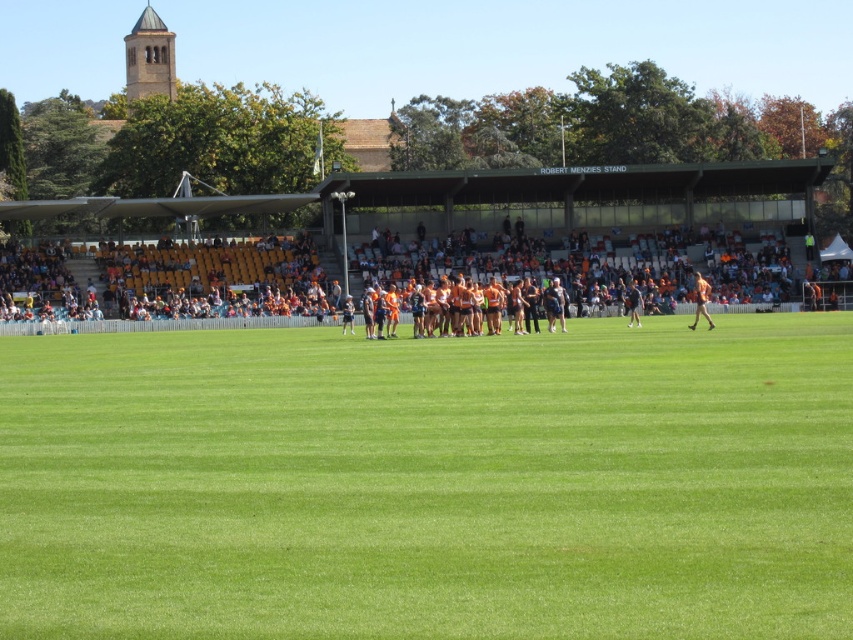
Looking at this image, can you confirm if orange jersey at center is positioned below orange uniformed person at center?

Actually, orange jersey at center is above orange uniformed person at center.

Is orange jersey at center to the left of orange uniformed person at center from the viewer's perspective?

In fact, orange jersey at center is to the right of orange uniformed person at center.

The image size is (853, 640). In order to click on orange jersey at center in this screenshot , I will do `click(700, 301)`.

Between green grass field at center and orange uniformed person at center, which one appears on the left side from the viewer's perspective?

green grass field at center is more to the left.

Measure the distance from green grass field at center to orange uniformed person at center.

green grass field at center and orange uniformed person at center are 20.10 meters apart from each other.

Is point (345, 506) more distant than point (628, 288)?

That is False.

The width and height of the screenshot is (853, 640). I want to click on green grass field at center, so click(x=430, y=483).

Does green grass field at center have a greater height compared to orange jersey at center?

No.

Describe the element at coordinates (430, 483) in the screenshot. I see `green grass field at center` at that location.

Image resolution: width=853 pixels, height=640 pixels. Identify the location of green grass field at center. (430, 483).